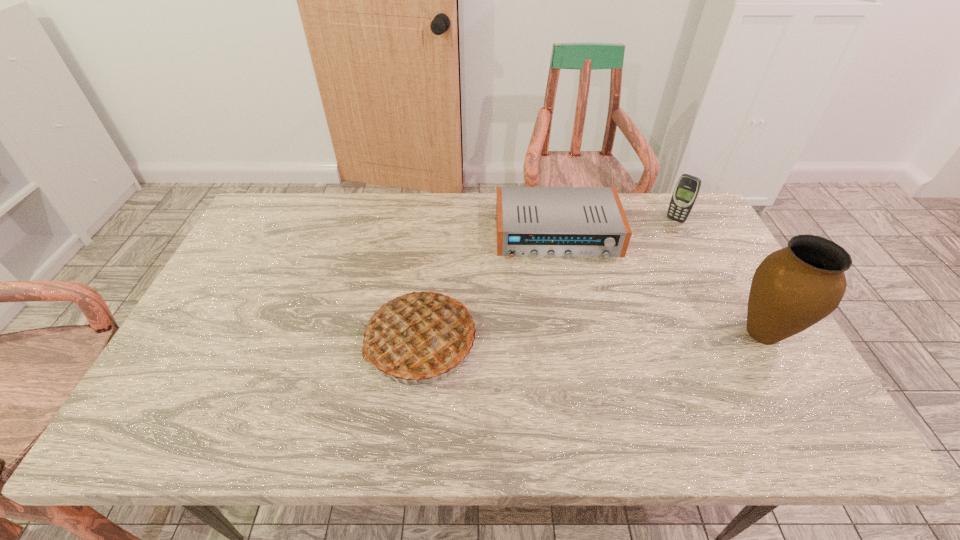
I want to click on pie, so click(420, 336).

Where is `the third shortest object`? the third shortest object is located at coordinates (420, 336).

Locate an element on the screen. This screenshot has width=960, height=540. the tallest object is located at coordinates (795, 287).

The width and height of the screenshot is (960, 540). I want to click on the second shortest object, so click(687, 188).

You are a GUI agent. You are given a task and a screenshot of the screen. Output one action in this format:
    pyautogui.click(x=<x>, y=<y>)
    Task: Click on the radio receiver
    The image size is (960, 540).
    Given the screenshot: What is the action you would take?
    pyautogui.click(x=568, y=222)

Identify the location of the shortest object. The image size is (960, 540). (568, 222).

The height and width of the screenshot is (540, 960). In order to click on vacant area situated on the right of the pie in this screenshot , I will do `click(504, 342)`.

Where is `free point located on the back of the urn`? This screenshot has width=960, height=540. free point located on the back of the urn is located at coordinates (737, 286).

The image size is (960, 540). I want to click on vacant space located 0.270m on the screen of the cellular telephone, so click(636, 267).

Locate an element on the screen. blank space located on the screen of the cellular telephone is located at coordinates (642, 258).